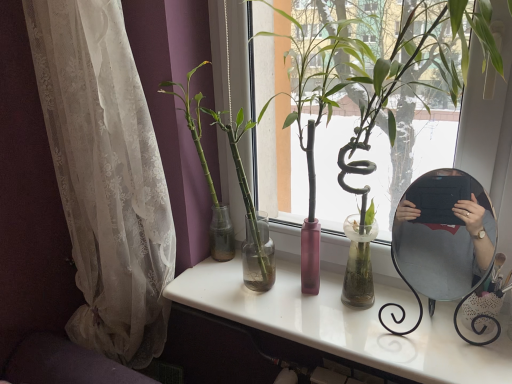
Question: Does point (498, 54) appear closer or farther from the camera than point (173, 279)?

Choices:
 (A) farther
 (B) closer

Answer: (B)

Question: Is green glossy bamboo at center, which is the second houseplant from left to right, to the left or to the right of white glossy desk at center in the image?

Choices:
 (A) right
 (B) left

Answer: (A)

Question: Which is farther from the white glossy desk at center?

Choices:
 (A) green glass vase at center, which ranks as the 2th houseplant in right-to-left order
 (B) green glossy bamboo at center, which is the second houseplant from left to right
 (C) metallic silver mirror at right
 (D) white lace curtain at left

Answer: (B)

Question: Which of these objects is positioned farthest from the green glossy bamboo at center, arranged as the 1th houseplant when viewed from the right?

Choices:
 (A) metallic silver mirror at right
 (B) white glossy desk at center
 (C) white lace curtain at left
 (D) green glass vase at center, which is the 1th houseplant in left-to-right order

Answer: (C)